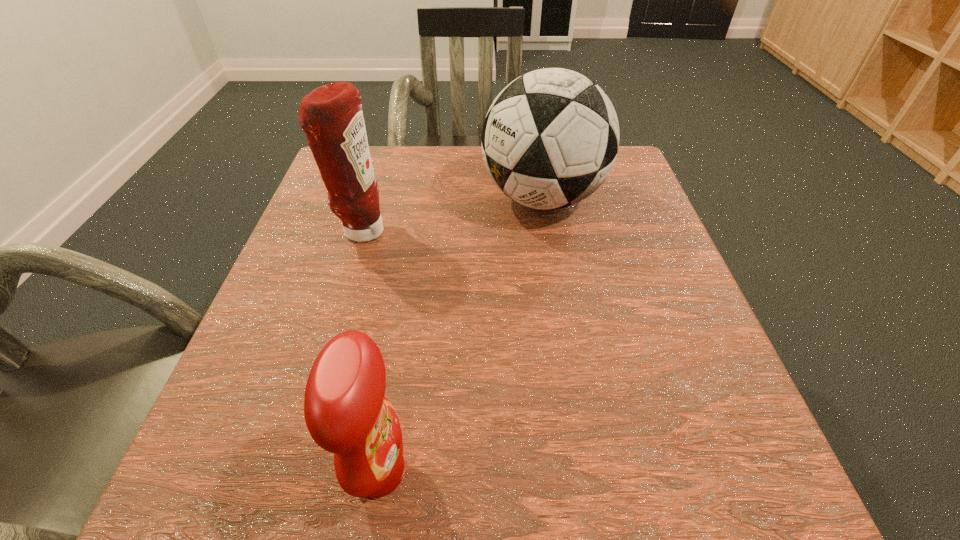
The width and height of the screenshot is (960, 540). Find the location of `object located in the far edge section of the desktop`. object located in the far edge section of the desktop is located at coordinates (550, 138).

At what (x,y) coordinates should I click in order to perform the action: click on object present at the near edge. Please return your answer as a coordinate pair (x, y). Looking at the image, I should click on (346, 413).

Where is `object located at the left edge`? object located at the left edge is located at coordinates (331, 116).

Locate an element on the screen. The image size is (960, 540). object that is at the right edge is located at coordinates (550, 138).

Find the location of a particular element. object present at the far right corner is located at coordinates (550, 138).

I want to click on vacant position at the far edge of the desktop, so click(x=476, y=178).

Locate an element on the screen. The height and width of the screenshot is (540, 960). vacant point at the near edge is located at coordinates (440, 484).

Find the location of a particular element. vacant area at the left edge is located at coordinates (363, 264).

Identify the location of free space at the far left corner of the desktop. The height and width of the screenshot is (540, 960). (397, 153).

The height and width of the screenshot is (540, 960). In the image, there is a desktop. What are the coordinates of `vacant space at the near right corner` in the screenshot? It's located at (691, 505).